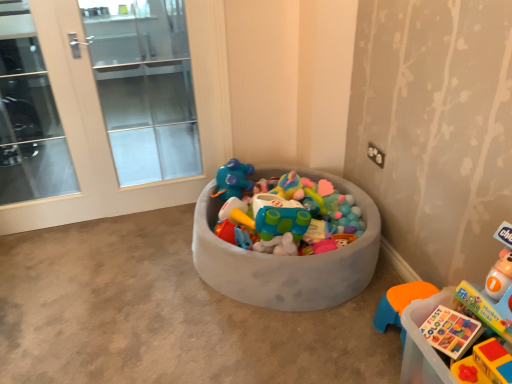
Question: Does gray fabric toy bin at center have a greater width compared to translucent plastic book at lower right, which is the first toy from back to front?

Choices:
 (A) yes
 (B) no

Answer: (A)

Question: Is gray fabric toy bin at center positioned with its back to translucent plastic book at lower right, which is the first toy from back to front?

Choices:
 (A) yes
 (B) no

Answer: (B)

Question: Considering the relative positions of gray fabric toy bin at center and translucent plastic book at lower right, which is the first toy from back to front, in the image provided, is gray fabric toy bin at center in front of translucent plastic book at lower right, which is the first toy from back to front,?

Choices:
 (A) no
 (B) yes

Answer: (A)

Question: Is gray fabric toy bin at center thinner than translucent plastic book at lower right, which is the first toy from back to front?

Choices:
 (A) yes
 (B) no

Answer: (B)

Question: Is translucent plastic book at lower right, which is the first toy from back to front, a part of gray fabric toy bin at center?

Choices:
 (A) no
 (B) yes

Answer: (A)

Question: Can you confirm if gray fabric toy bin at center is positioned to the right of translucent plastic book at lower right, which is the first toy from back to front?

Choices:
 (A) yes
 (B) no

Answer: (B)

Question: From the image's perspective, would you say gray fabric toy bin at center is shown under white glass screen door at left, which ranks as the 1th screen door in right-to-left order?

Choices:
 (A) no
 (B) yes

Answer: (B)

Question: From a real-world perspective, is gray fabric toy bin at center on top of white glass screen door at left, which ranks as the 1th screen door in right-to-left order?

Choices:
 (A) no
 (B) yes

Answer: (A)

Question: Does gray fabric toy bin at center have a larger size compared to white glass screen door at left, which ranks as the 1th screen door in right-to-left order?

Choices:
 (A) no
 (B) yes

Answer: (A)

Question: From a real-world perspective, is gray fabric toy bin at center beneath white glass screen door at left, positioned as the second screen door in left-to-right order?

Choices:
 (A) yes
 (B) no

Answer: (A)

Question: From the image's perspective, would you say gray fabric toy bin at center is positioned over white glass screen door at left, positioned as the second screen door in left-to-right order?

Choices:
 (A) no
 (B) yes

Answer: (A)

Question: Is gray fabric toy bin at center shorter than white glass screen door at left, which ranks as the 1th screen door in right-to-left order?

Choices:
 (A) no
 (B) yes

Answer: (B)

Question: Does white glass screen door at left, positioned as the second screen door in left-to-right order, lie behind gray fabric toy bin at center?

Choices:
 (A) no
 (B) yes

Answer: (B)